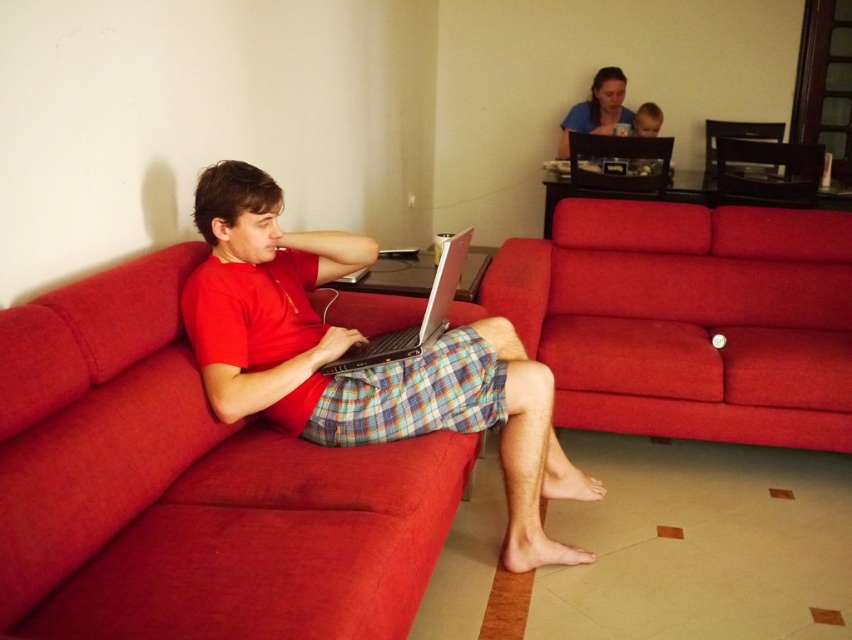
Question: Which object is farther from the camera taking this photo?

Choices:
 (A) velvet red couch at center
 (B) matte red shirt at center
 (C) plaid fabric laptop at center

Answer: (A)

Question: Estimate the real-world distances between objects in this image. Which object is closer to the red fabric couch at center?

Choices:
 (A) matte black laptop at center
 (B) velvet red couch at center
 (C) matte red shirt at center

Answer: (C)

Question: Is velvet red couch at center positioned before matte black laptop at center?

Choices:
 (A) no
 (B) yes

Answer: (A)

Question: Does velvet red couch at center have a lesser width compared to matte black laptop at center?

Choices:
 (A) yes
 (B) no

Answer: (B)

Question: Can you confirm if velvet red couch at center is positioned to the right of matte red shirt at center?

Choices:
 (A) no
 (B) yes

Answer: (B)

Question: Which point is farther to the camera?

Choices:
 (A) (337, 365)
 (B) (350, 253)

Answer: (B)